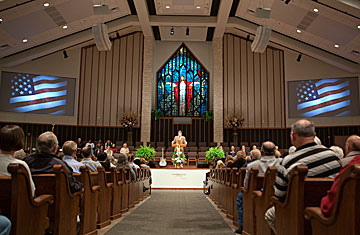
The height and width of the screenshot is (235, 360). Find the location of `large potted plants`. large potted plants is located at coordinates (233, 120), (127, 120), (148, 153), (220, 154).